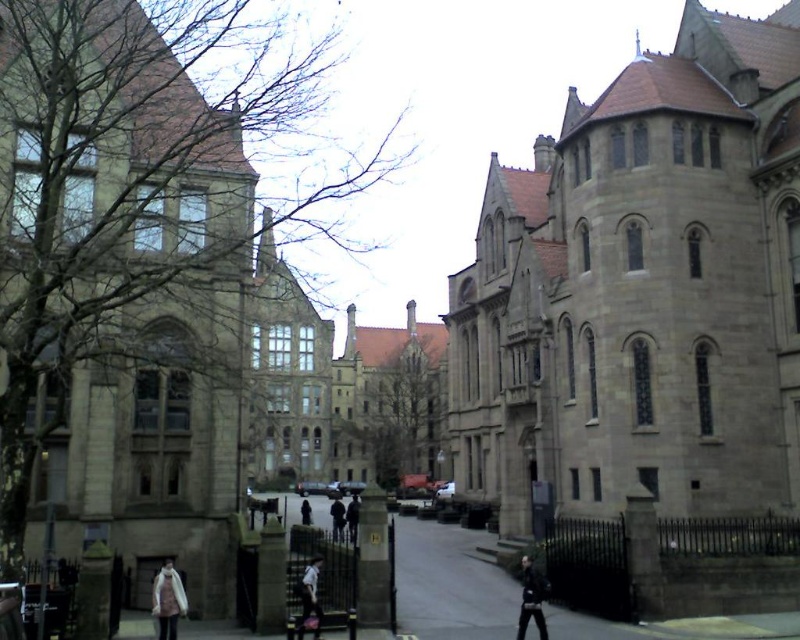
Question: Which point is closer to the camera?

Choices:
 (A) (296, 70)
 (B) (306, 512)

Answer: (B)

Question: Which of the following is the farthest from the observer?

Choices:
 (A) black fabric person at center
 (B) dark gray fabric jacket at center
 (C) dark blue jeans at center

Answer: (A)

Question: Is white wool coat at lower left smaller than dark gray jacket at center?

Choices:
 (A) no
 (B) yes

Answer: (B)

Question: Is stone textured church at center wider than dark blue jacket at center?

Choices:
 (A) no
 (B) yes

Answer: (B)

Question: Which object appears farthest from the camera in this image?

Choices:
 (A) dark gray jacket at center
 (B) dark blue jeans at center
 (C) stone textured church at center

Answer: (B)

Question: Can you confirm if bare branches at upper left is positioned to the right of dark blue jeans at center?

Choices:
 (A) no
 (B) yes

Answer: (A)